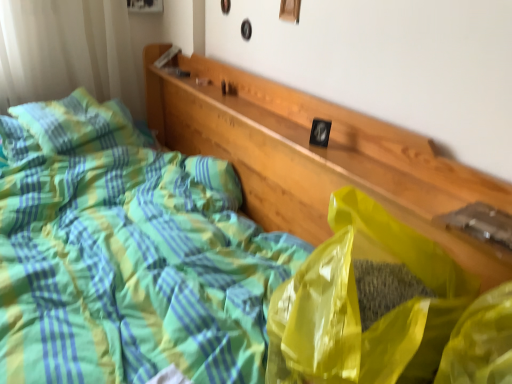
Question: Considering the relative sizes of yellow translucent plastic bag at center and green plaid pillow at upper left in the image provided, is yellow translucent plastic bag at center bigger than green plaid pillow at upper left?

Choices:
 (A) no
 (B) yes

Answer: (B)

Question: From a real-world perspective, is yellow translucent plastic bag at center located beneath green plaid pillow at upper left?

Choices:
 (A) no
 (B) yes

Answer: (A)

Question: Considering the relative sizes of yellow translucent plastic bag at center and green plaid pillow at upper left in the image provided, is yellow translucent plastic bag at center thinner than green plaid pillow at upper left?

Choices:
 (A) yes
 (B) no

Answer: (A)

Question: Is yellow translucent plastic bag at center with green plaid pillow at upper left?

Choices:
 (A) no
 (B) yes

Answer: (A)

Question: Would you say green plaid pillow at upper left is part of yellow translucent plastic bag at center's contents?

Choices:
 (A) no
 (B) yes

Answer: (A)

Question: Does yellow translucent plastic bag at center have a smaller size compared to green plaid pillow at upper left?

Choices:
 (A) yes
 (B) no

Answer: (B)

Question: Considering the relative sizes of green plaid pillow at upper left and yellow translucent plastic bag at center in the image provided, is green plaid pillow at upper left shorter than yellow translucent plastic bag at center?

Choices:
 (A) yes
 (B) no

Answer: (A)

Question: Is green plaid pillow at upper left positioned in front of yellow translucent plastic bag at center?

Choices:
 (A) yes
 (B) no

Answer: (B)

Question: From a real-world perspective, is green plaid pillow at upper left beneath yellow translucent plastic bag at center?

Choices:
 (A) no
 (B) yes

Answer: (B)

Question: Considering the relative positions of green plaid pillow at upper left and yellow translucent plastic bag at center in the image provided, is green plaid pillow at upper left behind yellow translucent plastic bag at center?

Choices:
 (A) yes
 (B) no

Answer: (A)

Question: Is green plaid pillow at upper left not close to yellow translucent plastic bag at center?

Choices:
 (A) no
 (B) yes

Answer: (B)

Question: From the image's perspective, would you say green plaid pillow at upper left is shown under yellow translucent plastic bag at center?

Choices:
 (A) yes
 (B) no

Answer: (B)

Question: Based on their sizes in the image, would you say yellow translucent plastic bag at center is bigger or smaller than green plaid pillow at upper left?

Choices:
 (A) big
 (B) small

Answer: (A)